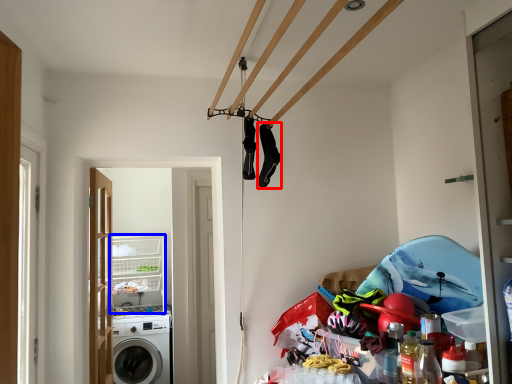
Question: Among these objects, which one is nearest to the camera, clothing (highlighted by a red box) or shelf (highlighted by a blue box)?

Choices:
 (A) clothing
 (B) shelf

Answer: (A)